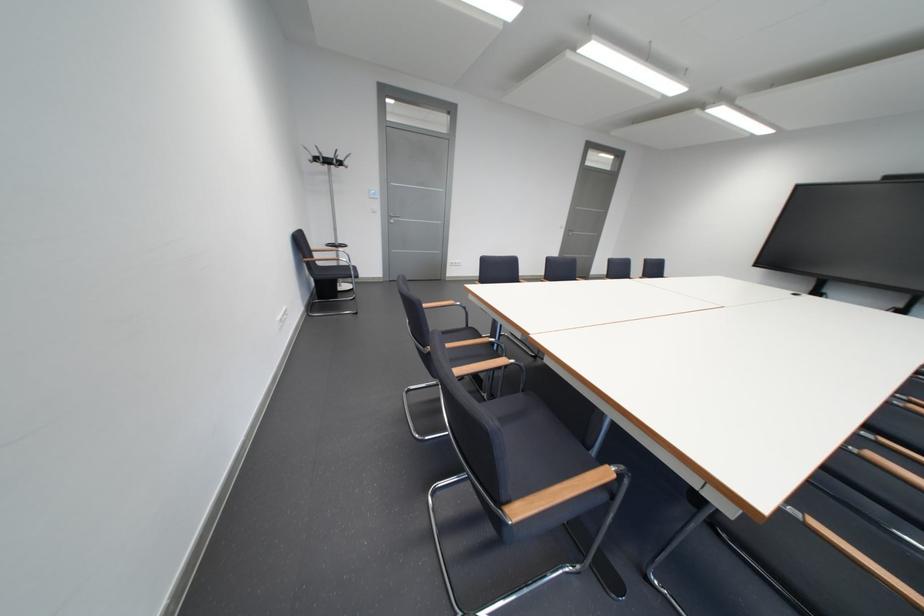
Find where to sit the black chair sitting surface. Please return your answer as a coordinate pair (x, y).

(532, 447)